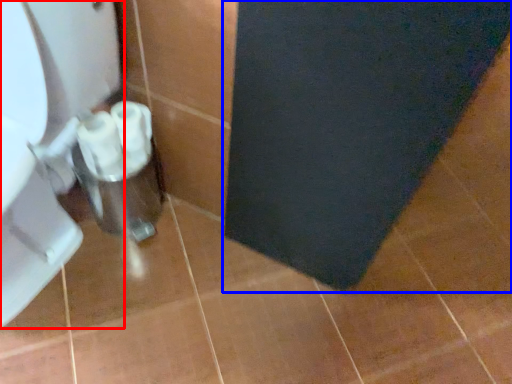
Question: Which point is closer to the camera, toilet (highlighted by a red box) or bath mat (highlighted by a blue box)?

Choices:
 (A) toilet
 (B) bath mat

Answer: (A)